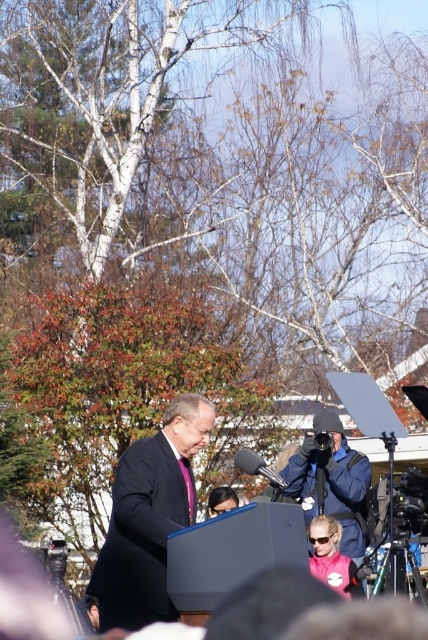
Question: From the image, what is the correct spatial relationship of matte black suit at center in relation to matte black camera at center?

Choices:
 (A) left
 (B) right

Answer: (A)

Question: Which point is farther to the camera?

Choices:
 (A) matte black suit at center
 (B) matte black camera at center

Answer: (B)

Question: Can you confirm if matte black suit at center is thinner than matte black camera at center?

Choices:
 (A) yes
 (B) no

Answer: (B)

Question: Does matte black suit at center have a smaller size compared to matte black camera at center?

Choices:
 (A) no
 (B) yes

Answer: (A)